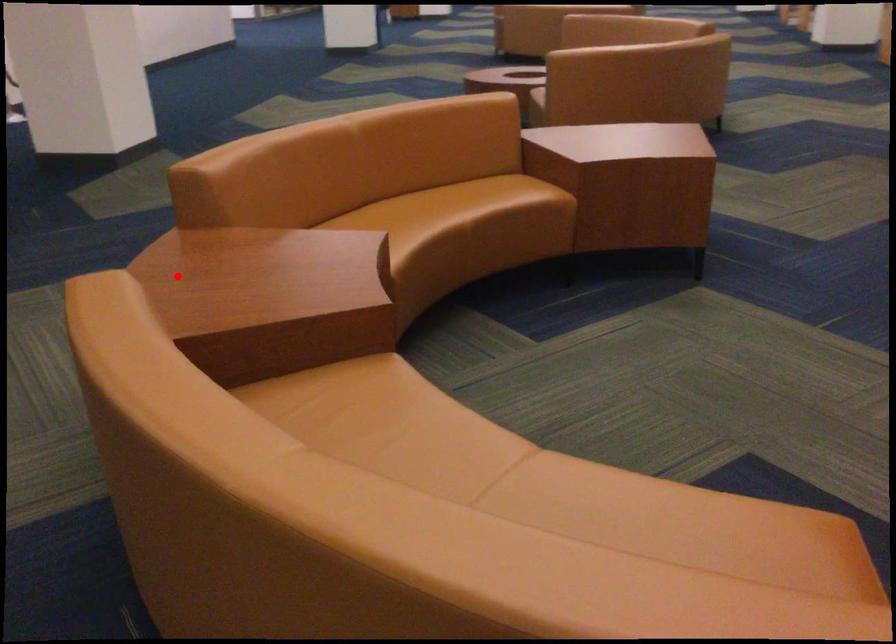
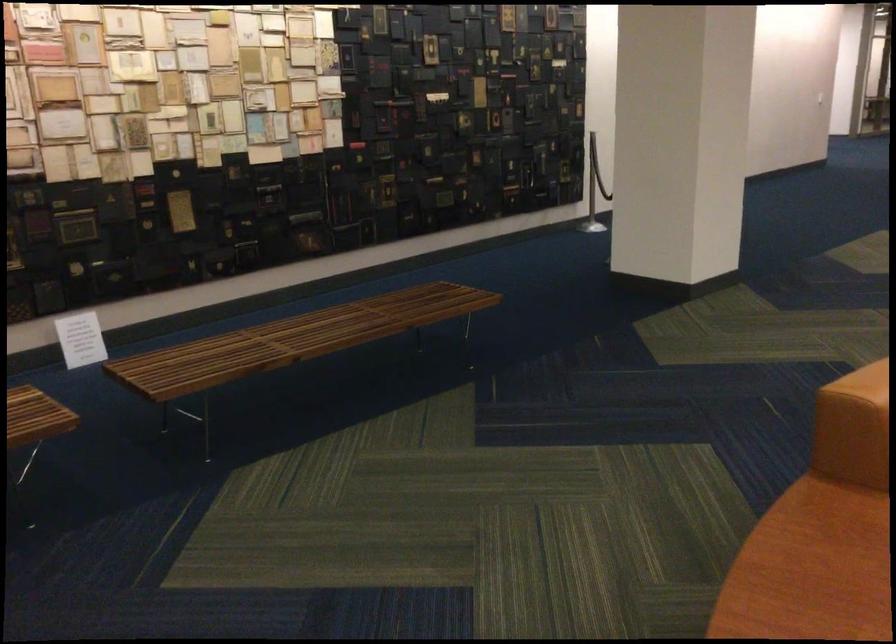
Question: I am providing you with two images of the same scene from different viewpoints. A red point is marked on the first image. Is the red point's position out of view in image 2?

Choices:
 (A) Yes
 (B) No

Answer: (B)